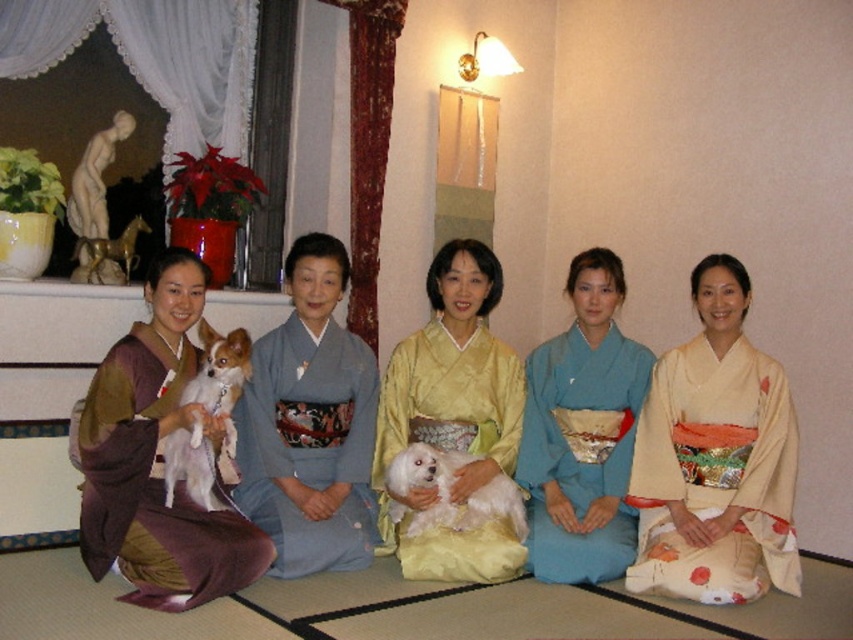
Question: Can you confirm if white silk kimono at center is positioned to the right of yellow silk kimono at center?

Choices:
 (A) yes
 (B) no

Answer: (A)

Question: Can you confirm if white silk kimono at center is positioned below white fluffy dog at left?

Choices:
 (A) yes
 (B) no

Answer: (A)

Question: Which of the following is the farthest from the observer?

Choices:
 (A) yellow silk kimono at center
 (B) white fluffy dog at left

Answer: (A)

Question: Which point is closer to the camera taking this photo?

Choices:
 (A) (190, 529)
 (B) (531, 444)
 (C) (692, 280)
 (D) (189, 467)

Answer: (A)

Question: Does white silk kimono at center have a larger size compared to blue silk kimono at center?

Choices:
 (A) yes
 (B) no

Answer: (A)

Question: Which of these objects is positioned closest to the white fluffy dog at center?

Choices:
 (A) white silk kimono at center
 (B) blue silk kimono at center
 (C) white fluffy dog at left
 (D) silky blue kimono at center

Answer: (B)